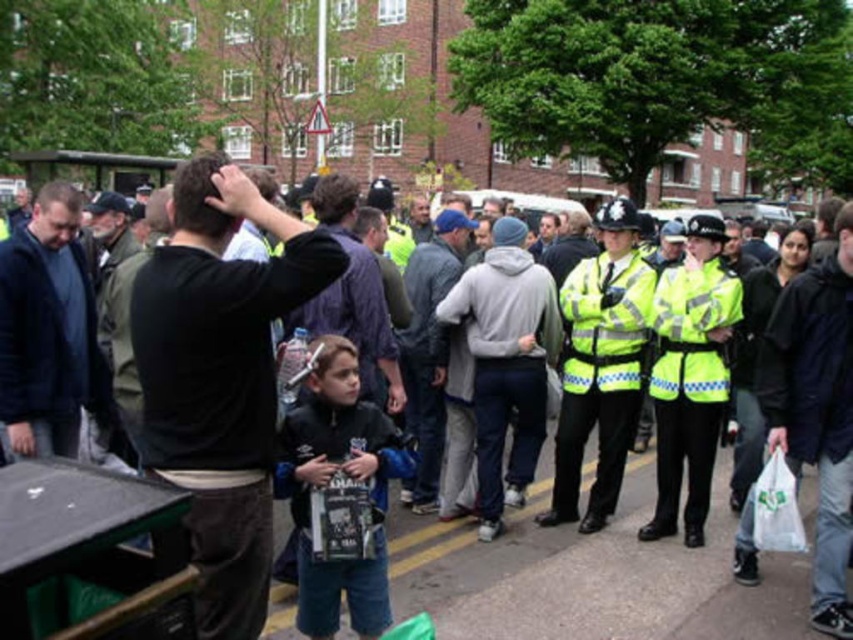
Question: Is dark blue jacket at left below high-visibility reflective jacket at center-right?

Choices:
 (A) no
 (B) yes

Answer: (A)

Question: Can you confirm if dark blue jacket at right is thinner than dark blue jacket at left?

Choices:
 (A) no
 (B) yes

Answer: (A)

Question: Which of these objects is positioned closest to the high-visibility reflective jacket at center?

Choices:
 (A) dark blue jacket at left
 (B) black cotton shirt at center
 (C) dark blue jacket at right

Answer: (C)

Question: Does dark blue jacket at right appear under high-visibility reflective jacket at center-right?

Choices:
 (A) no
 (B) yes

Answer: (B)

Question: Which object is the farthest from the dark blue jacket at right?

Choices:
 (A) black cotton shirt at center
 (B) dark gray jacket at center
 (C) dark blue jacket at left
 (D) high-visibility reflective jacket at center

Answer: (C)

Question: Among these objects, which one is farthest from the camera?

Choices:
 (A) dark blue jacket at left
 (B) high-visibility reflective jacket at center-right
 (C) dark gray jacket at center

Answer: (C)